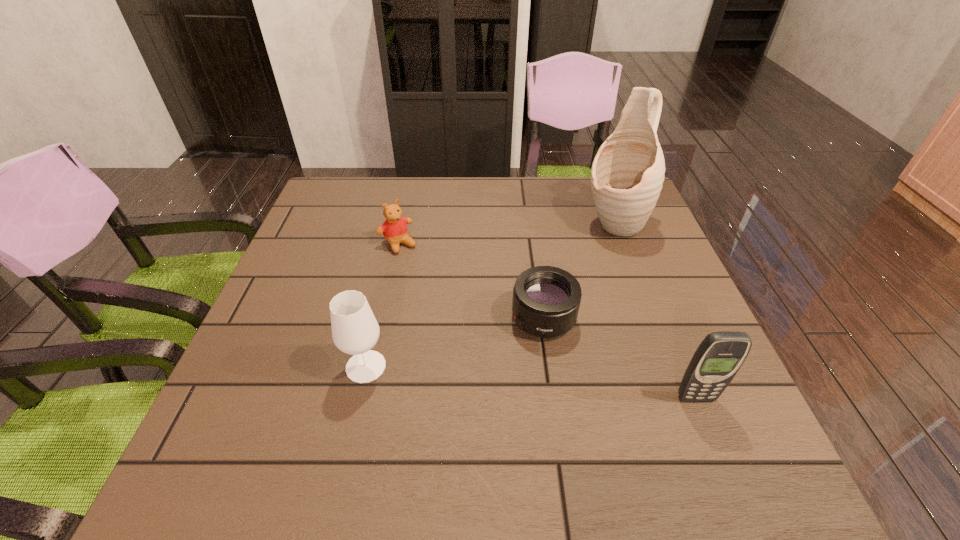
Image resolution: width=960 pixels, height=540 pixels. In order to click on glass in this screenshot , I will do `click(355, 331)`.

Where is `cellular telephone`? The image size is (960, 540). cellular telephone is located at coordinates (720, 355).

Find the location of a particular element. The image size is (960, 540). the tallest object is located at coordinates (627, 174).

Identify the location of the third nearest object. (546, 299).

The height and width of the screenshot is (540, 960). In order to click on telephoto lens in this screenshot , I will do `click(546, 299)`.

Where is `teddy bear`? Image resolution: width=960 pixels, height=540 pixels. teddy bear is located at coordinates (394, 229).

Locate an element on the screen. This screenshot has height=540, width=960. vacant space located 0.120m on the back of the glass is located at coordinates (379, 307).

This screenshot has height=540, width=960. I want to click on free location located on the screen of the cellular telephone, so click(708, 428).

Where is `vacant space located at the spout of the pitcher`? vacant space located at the spout of the pitcher is located at coordinates 561,296.

Image resolution: width=960 pixels, height=540 pixels. What are the coordinates of `vacant space located at the spout of the pitcher` in the screenshot? It's located at (583, 268).